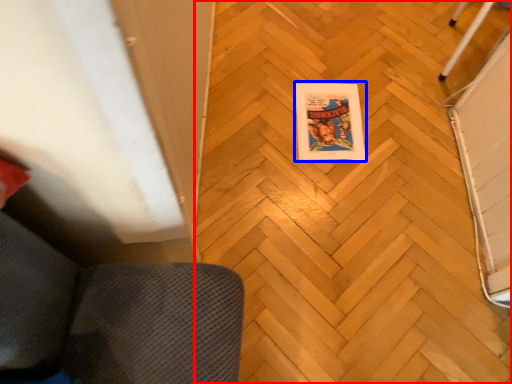
Question: Which point is closer to the camera, plywood (highlighted by a red box) or comic book (highlighted by a blue box)?

Choices:
 (A) plywood
 (B) comic book

Answer: (A)